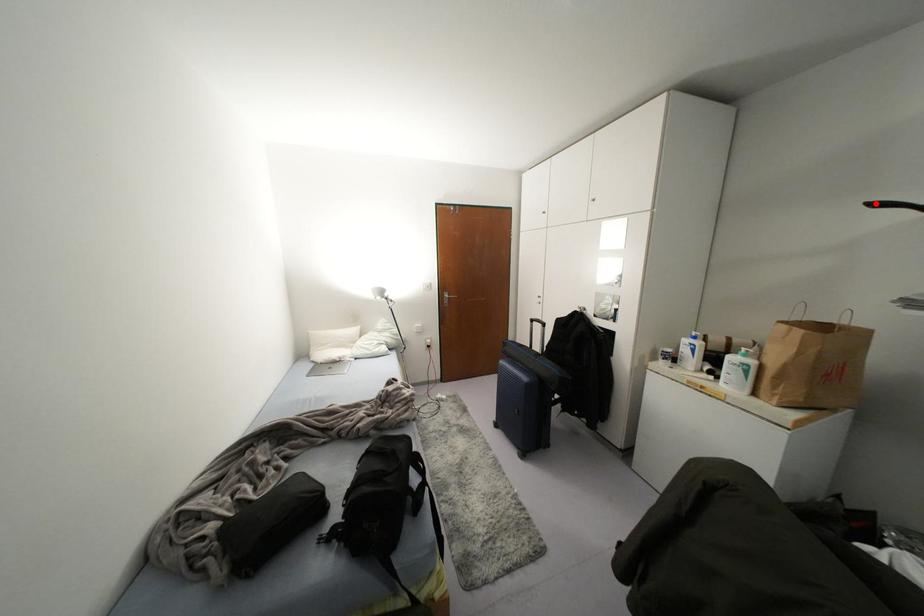
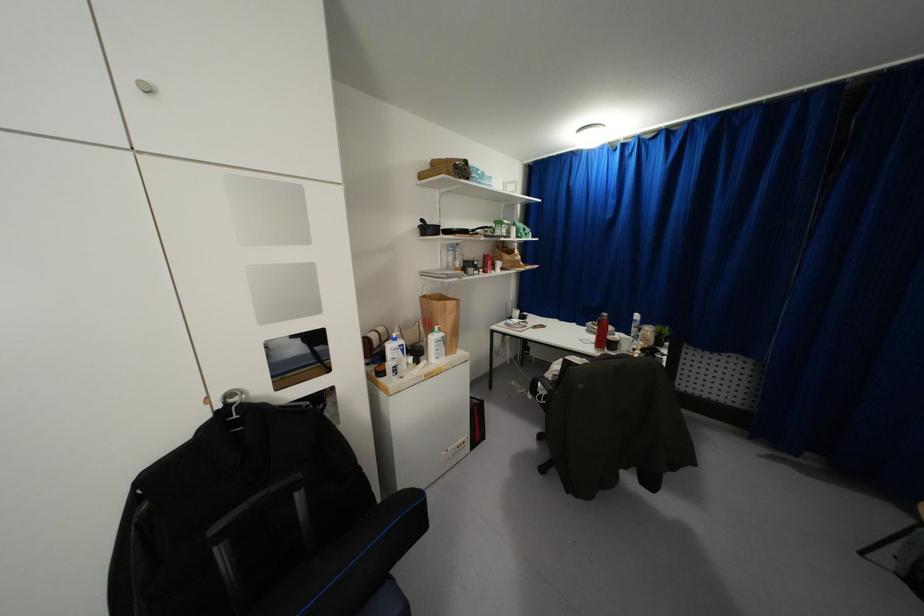
Question: I am providing you with two images of the same scene from different viewpoints. A red point is shown in image1. For the corresponding object point in image2, is it positioned nearer or farther from the camera?

Choices:
 (A) Nearer
 (B) Farther

Answer: (A)